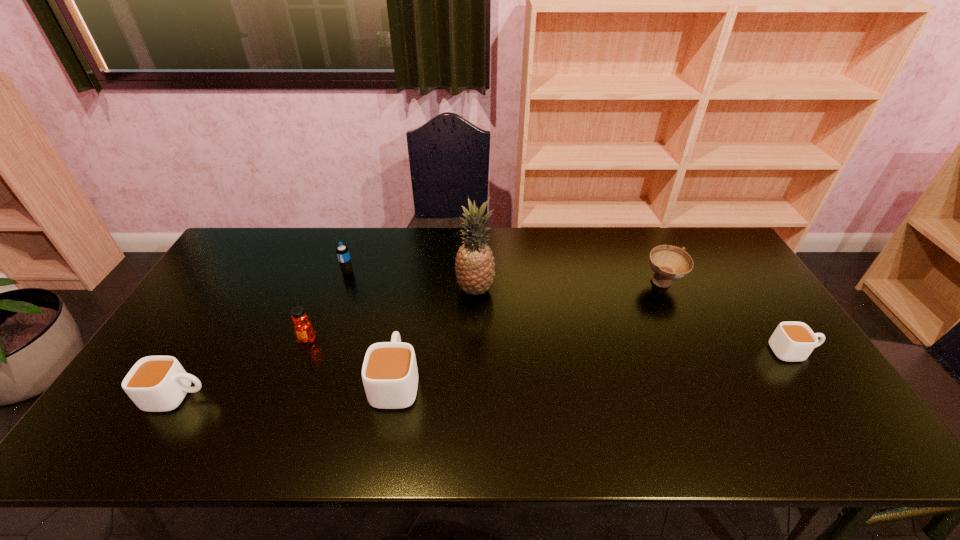
Where is `object that is at the left edge`? Image resolution: width=960 pixels, height=540 pixels. object that is at the left edge is located at coordinates (155, 383).

Where is `object situated at the right edge`? object situated at the right edge is located at coordinates (791, 341).

You are a GUI agent. You are given a task and a screenshot of the screen. Output one action in this format:
    pyautogui.click(x=<x>, y=<y>)
    Task: Click on the object present at the near left corner
    The image size is (960, 540).
    Given the screenshot: What is the action you would take?
    click(155, 383)

What are the coordinates of `free space at the far edge` in the screenshot? It's located at (285, 259).

This screenshot has height=540, width=960. Identify the location of vacant space at the near edge. (631, 401).

The width and height of the screenshot is (960, 540). Find the location of `free space at the right edge of the desktop`. free space at the right edge of the desktop is located at coordinates (707, 280).

This screenshot has height=540, width=960. What are the coordinates of `blank space at the far left corner of the desktop` in the screenshot? It's located at (261, 242).

At what (x,y) coordinates should I click in order to perform the action: click on vacant space at the far right corner of the desktop. Please return your answer as a coordinate pair (x, y). Image resolution: width=960 pixels, height=540 pixels. Looking at the image, I should click on (708, 236).

The image size is (960, 540). What are the coordinates of `unoccupied area between the rightmost cup and the tallest cup` in the screenshot? It's located at (594, 366).

I want to click on free space between the second shortest cup and the sixth object from left to right, so click(420, 340).